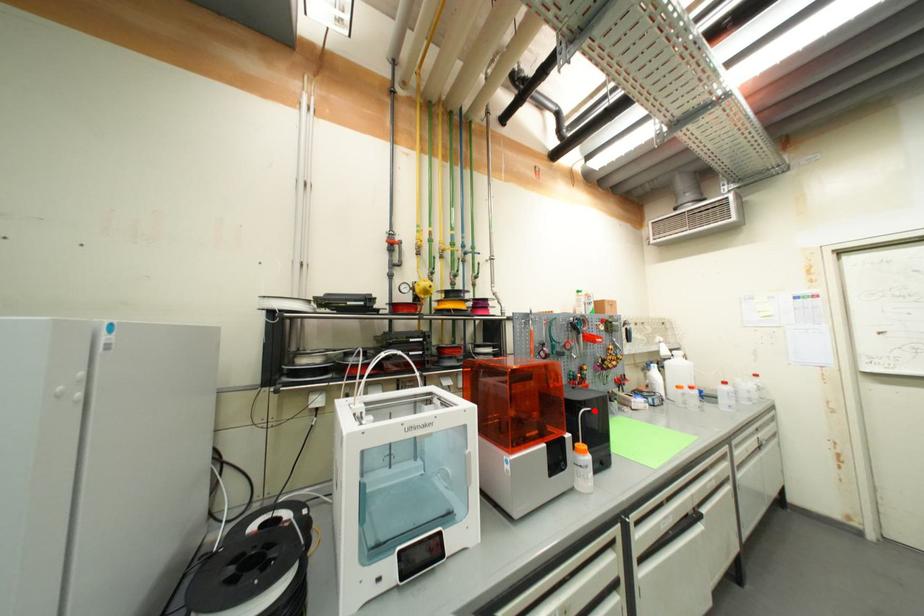
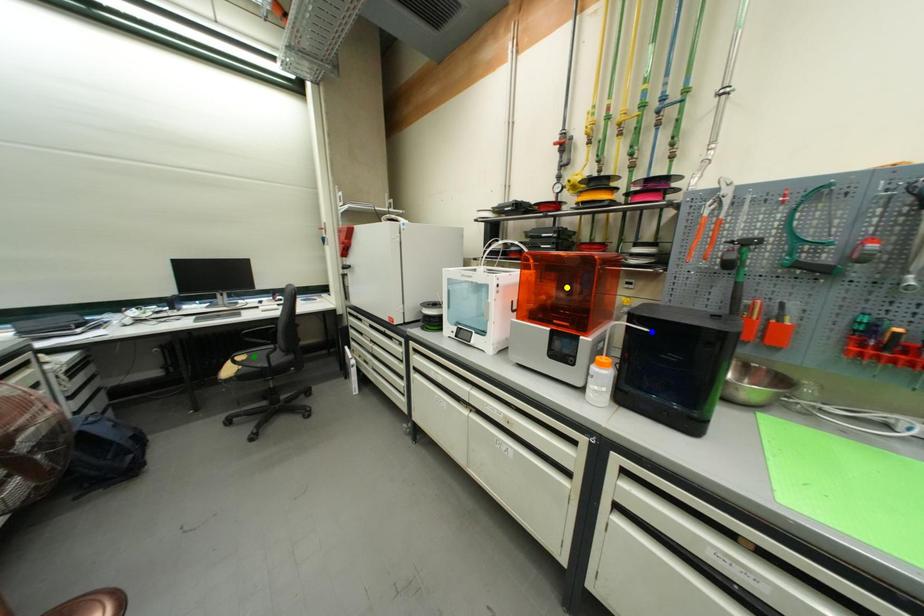
Question: I am providing you with two images of the same scene from different viewpoints. A red point is marked on the first image. You are given multiple points on the second image. Which spot in image 2 lines up with the point in image 1?

Choices:
 (A) green point
 (B) yellow point
 (C) blue point

Answer: (C)